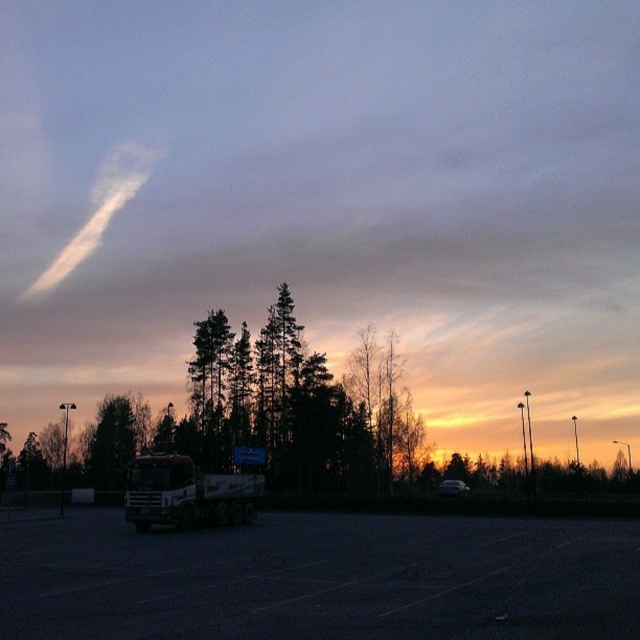
You are a delivery driver who needs to park your truck in the parking lot shown. You see the white matte truck at center and the matte white truck at lower center. Which truck should you avoid parking to the right of to stay within the parking space lines?

You should avoid parking to the right of the white matte truck at center because it is positioned to the left of the matte white truck at lower center, so parking to its right would place you closer to the other truck and possibly outside the parking space lines.

You are standing in the parking lot and want to take a photo of the white matte truck at center. Since the black asphalt parking lot at center is in the way, will you need to move closer or farther away to get the truck in focus?

The black asphalt parking lot at center is closer to the viewer than the white matte truck at center. To focus on the white matte truck at center, you would need to move farther away from the parking lot so that the truck becomes closer than the foreground obstruction.